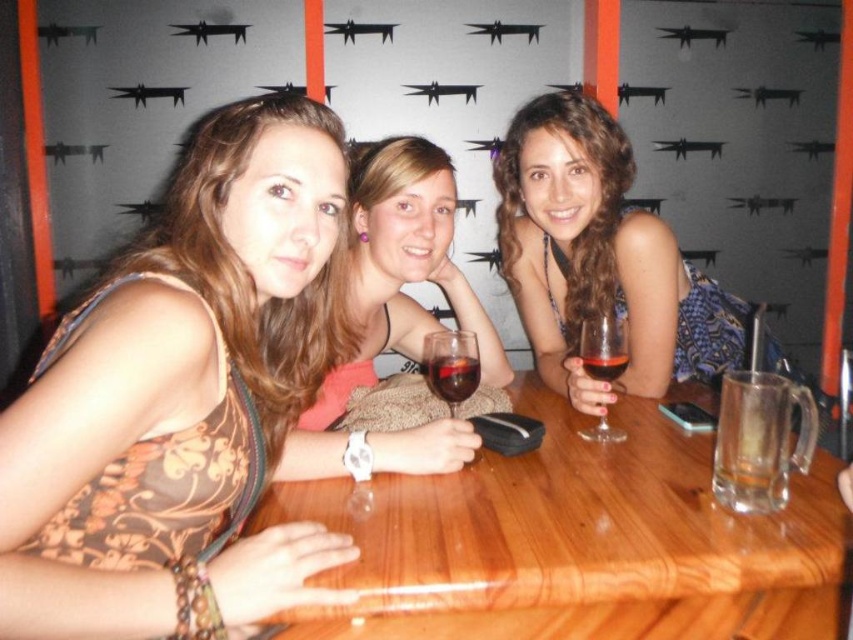
You are a GUI agent. You are given a task and a screenshot of the screen. Output one action in this format:
    pyautogui.click(x=<x>, y=<y>)
    Task: Click on the floral-patterned tank top at left
    
    Given the screenshot: What is the action you would take?
    click(181, 397)

Who is taller, floral-patterned tank top at left or wooden table at center?

floral-patterned tank top at left is taller.

Find the location of a particular element. This screenshot has width=853, height=640. floral-patterned tank top at left is located at coordinates (181, 397).

Does translucent glass wine glass at center appear over dark red glass at center?

Actually, translucent glass wine glass at center is below dark red glass at center.

What are the coordinates of `translucent glass wine glass at center` in the screenshot? It's located at (602, 348).

Looking at this image, is floral-patterned tank top at left to the left of translucent glass wine glass at center from the viewer's perspective?

Correct, you'll find floral-patterned tank top at left to the left of translucent glass wine glass at center.

Is point (282, 385) positioned in front of point (589, 372)?

That is True.

Who is more distant from viewer, (283, 180) or (611, 368)?

The point (611, 368) is behind.

At what (x,y) coordinates should I click in order to perform the action: click on floral-patterned tank top at left. Please return your answer as a coordinate pair (x, y). Looking at the image, I should click on (181, 397).